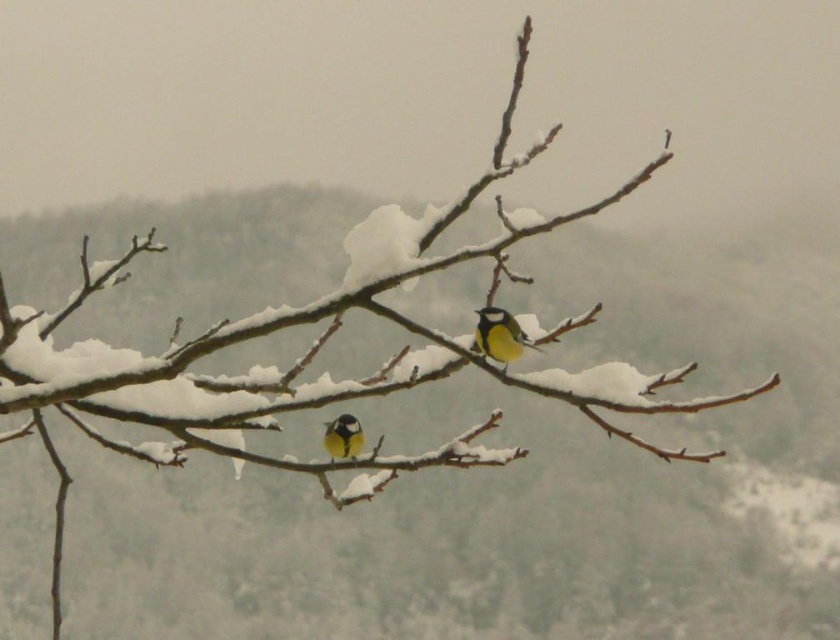
Question: Is yellow matte bird at center above yellow-green feathers at center?

Choices:
 (A) no
 (B) yes

Answer: (B)

Question: Which point appears farthest from the camera in this image?

Choices:
 (A) (348, 458)
 (B) (491, 330)

Answer: (A)

Question: Can you confirm if yellow matte bird at center is bigger than yellow-green feathers at center?

Choices:
 (A) no
 (B) yes

Answer: (A)

Question: Can you confirm if yellow matte bird at center is wider than yellow-green feathers at center?

Choices:
 (A) yes
 (B) no

Answer: (A)